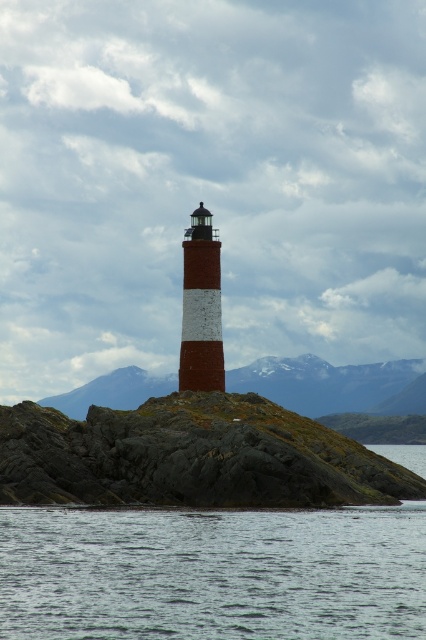
You are standing at the base of the lighthouse on the rocky outcrop. You want to reach the gray water at lower center located at point (213, 573). Which direction should you move relative to the lighthouse to get there?

The gray water at lower center is located at point (213, 573), so you should move towards the lower center direction relative to the lighthouse to reach it.

You are a photographer planning to capture the lighthouse and the water in the scene. Given that the gray water at lower center and the brick textured lighthouse at center are both in your viewfinder, which object will occupy more of the frame?

The gray water at lower center will occupy more of the frame because it is bigger than the brick textured lighthouse at center according to the description.

You are a photographer positioned at the base of the lighthouse. You want to capture both the lighthouse and the distant sea in a single shot. You notice two points marked in the scene. One is at point (204, 502) and the other at point (196, 224). Which point should you focus on to ensure both the lighthouse and the distant sea are in sharp focus?

You should focus on point (196, 224) because it is farther from the camera than point (204, 502). By focusing on the farther point, the depth of field will include both the closer lighthouse and the distant sea.